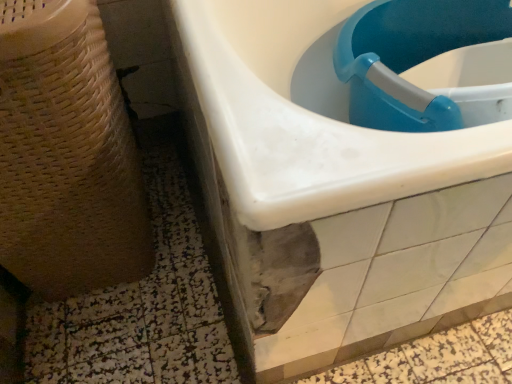
Question: Should I look upward or downward to see beige woven basket at left?

Choices:
 (A) up
 (B) down

Answer: (A)

Question: From the image's perspective, is blue plastic sink at upper right, which is the first sink in left-to-right order, below blue plastic sink at upper right, the first sink positioned from the right?

Choices:
 (A) yes
 (B) no

Answer: (B)

Question: From the image's perspective, is blue plastic sink at upper right, which is the first sink in left-to-right order, on blue plastic sink at upper right, marked as the 2th sink in a left-to-right arrangement?

Choices:
 (A) no
 (B) yes

Answer: (B)

Question: Is blue plastic sink at upper right, the first sink positioned from the right, a part of blue plastic sink at upper right, which is the first sink in left-to-right order?

Choices:
 (A) yes
 (B) no

Answer: (A)

Question: Considering the relative sizes of blue plastic sink at upper right, which is the first sink in left-to-right order, and blue plastic sink at upper right, the first sink positioned from the right, in the image provided, is blue plastic sink at upper right, which is the first sink in left-to-right order, shorter than blue plastic sink at upper right, the first sink positioned from the right,?

Choices:
 (A) no
 (B) yes

Answer: (B)

Question: Is blue plastic sink at upper right, marked as the 2th sink in a right-to-left arrangement, oriented away from blue plastic sink at upper right, the first sink positioned from the right?

Choices:
 (A) yes
 (B) no

Answer: (A)

Question: Can you confirm if blue plastic sink at upper right, which is the first sink in left-to-right order, is positioned to the left of blue plastic sink at upper right, marked as the 2th sink in a left-to-right arrangement?

Choices:
 (A) no
 (B) yes

Answer: (B)

Question: Could blue plastic sink at upper right, which is the first sink in left-to-right order, be considered to be inside beige woven basket at left?

Choices:
 (A) yes
 (B) no

Answer: (B)

Question: Is there a large distance between beige woven basket at left and blue plastic sink at upper right, which is the first sink in left-to-right order?

Choices:
 (A) no
 (B) yes

Answer: (A)

Question: Does beige woven basket at left appear on the right side of blue plastic sink at upper right, which is the first sink in left-to-right order?

Choices:
 (A) no
 (B) yes

Answer: (A)

Question: From a real-world perspective, does beige woven basket at left sit lower than blue plastic sink at upper right, marked as the 2th sink in a right-to-left arrangement?

Choices:
 (A) yes
 (B) no

Answer: (B)

Question: Is blue plastic sink at upper right, marked as the 2th sink in a right-to-left arrangement, at the back of beige woven basket at left?

Choices:
 (A) no
 (B) yes

Answer: (A)

Question: Is beige woven basket at left taller than blue plastic sink at upper right, which is the first sink in left-to-right order?

Choices:
 (A) no
 (B) yes

Answer: (B)

Question: Considering the relative sizes of blue plastic sink at upper right, marked as the 2th sink in a right-to-left arrangement, and beige woven basket at left in the image provided, is blue plastic sink at upper right, marked as the 2th sink in a right-to-left arrangement, taller than beige woven basket at left?

Choices:
 (A) no
 (B) yes

Answer: (A)